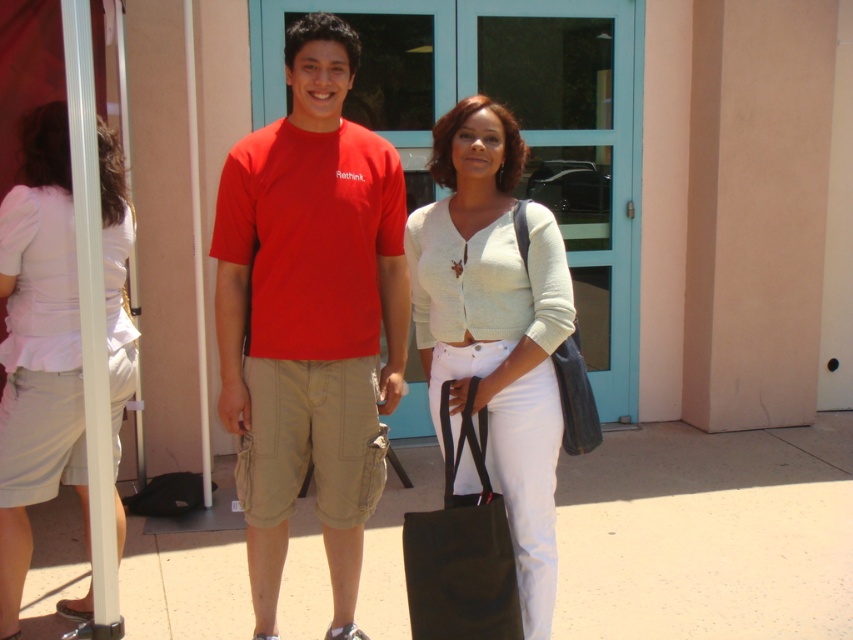
Question: Among these objects, which one is nearest to the camera?

Choices:
 (A) leather-like black bag at center
 (B) black fabric bag at lower center
 (C) white textured sweater at center
 (D) smooth concrete pavement at center

Answer: (B)

Question: Is the position of matte red t-shirt at center less distant than that of white textured sweater at center?

Choices:
 (A) no
 (B) yes

Answer: (A)

Question: Does smooth concrete pavement at center have a lesser width compared to leather-like black bag at center?

Choices:
 (A) yes
 (B) no

Answer: (B)

Question: Can you confirm if white textured sweater at center is thinner than light pink fabric blouse at left?

Choices:
 (A) no
 (B) yes

Answer: (A)

Question: Which object appears farthest from the camera in this image?

Choices:
 (A) white textured sweater at center
 (B) light pink fabric blouse at left
 (C) smooth concrete pavement at center

Answer: (C)

Question: Which point is farther from the camera taking this photo?

Choices:
 (A) (569, 387)
 (B) (131, 566)
 (C) (444, 208)

Answer: (B)